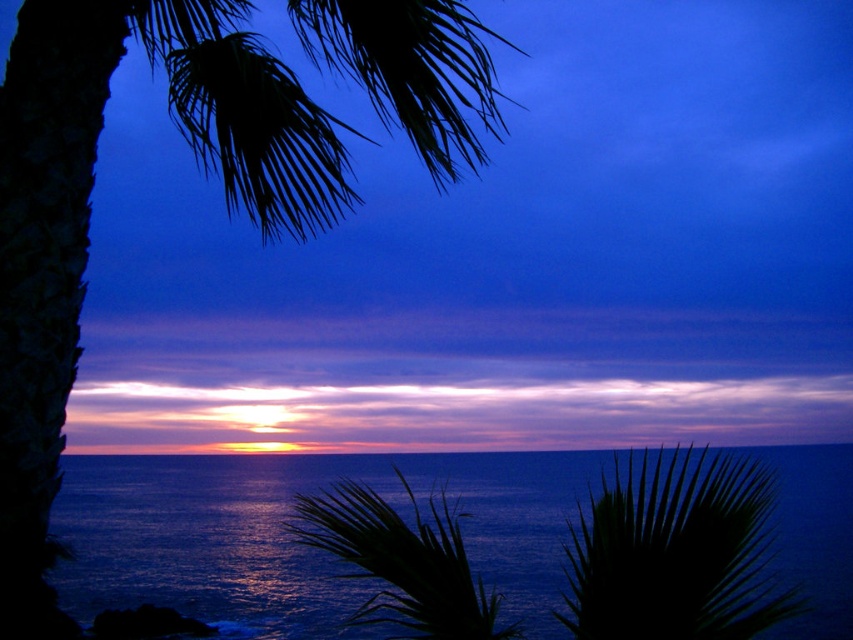
Is silky green fronds at upper left wider than blue liquid water at center?

No.

Between point (247, 10) and point (637, 454), which one is positioned behind?

The point (247, 10) is behind.

Where is `silky green fronds at upper left`? silky green fronds at upper left is located at coordinates (90, 211).

Does silky green fronds at upper left have a greater height compared to green leafy palm at center?

No.

Which of these two, silky green fronds at upper left or green leafy palm at center, stands taller?

green leafy palm at center is taller.

Is point (199, 83) positioned before point (428, 573)?

That is False.

Where is `silky green fronds at upper left`? The width and height of the screenshot is (853, 640). silky green fronds at upper left is located at coordinates (90, 211).

Between point (675, 532) and point (437, 582), which one is positioned behind?

Point (675, 532)

Does green leafy palm at lower right have a greater width compared to green leafy palm at center?

Incorrect, green leafy palm at lower right's width does not surpass green leafy palm at center's.

Image resolution: width=853 pixels, height=640 pixels. Find the location of `green leafy palm at lower right`. green leafy palm at lower right is located at coordinates (675, 552).

This screenshot has height=640, width=853. I want to click on green leafy palm at lower right, so click(x=675, y=552).